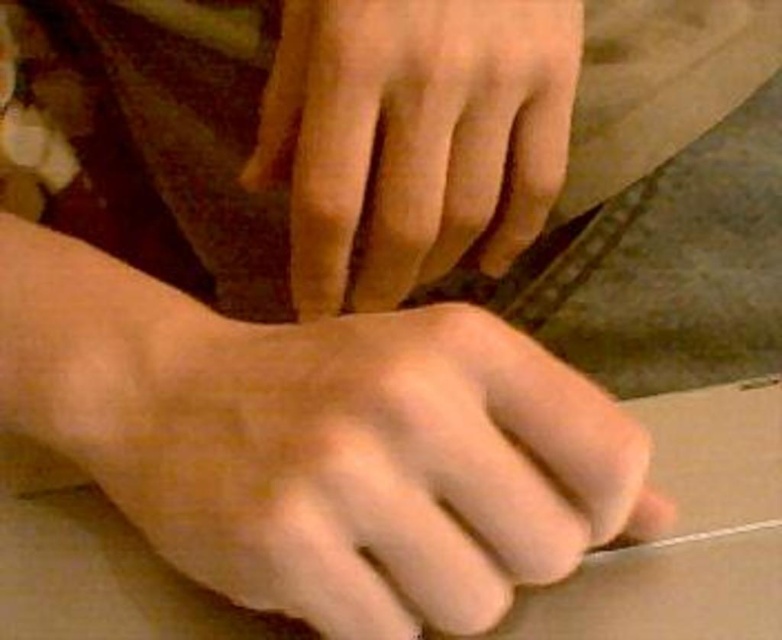
Question: Does smooth skin hand at lower center lie in front of smooth skin hand at center?

Choices:
 (A) yes
 (B) no

Answer: (A)

Question: Is smooth skin hand at lower center wider than smooth skin hand at center?

Choices:
 (A) yes
 (B) no

Answer: (A)

Question: Can you confirm if smooth skin hand at lower center is bigger than smooth skin hand at center?

Choices:
 (A) no
 (B) yes

Answer: (B)

Question: Which point appears farthest from the camera in this image?

Choices:
 (A) (327, 572)
 (B) (558, 108)

Answer: (B)